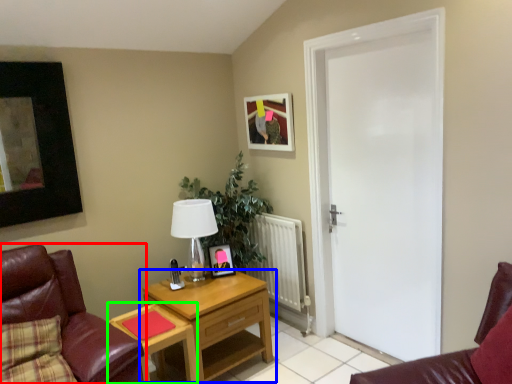
Question: Which object is positioned farthest from chair (highlighted by a red box)? Select from nightstand (highlighted by a blue box) and desk (highlighted by a green box).

Choices:
 (A) nightstand
 (B) desk

Answer: (A)